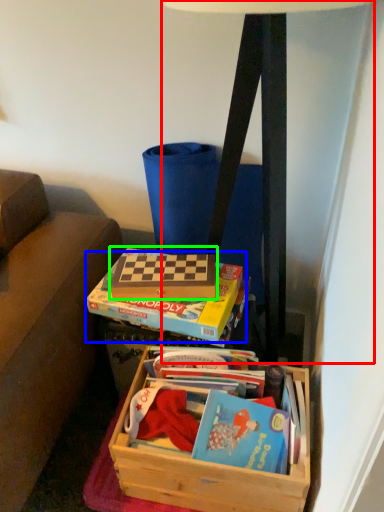
Question: Considering the real-world distances, which object is closest to table lamp (highlighted by a red box)? paperback book (highlighted by a blue box) or paperback book (highlighted by a green box).

Choices:
 (A) paperback book
 (B) paperback book

Answer: (B)